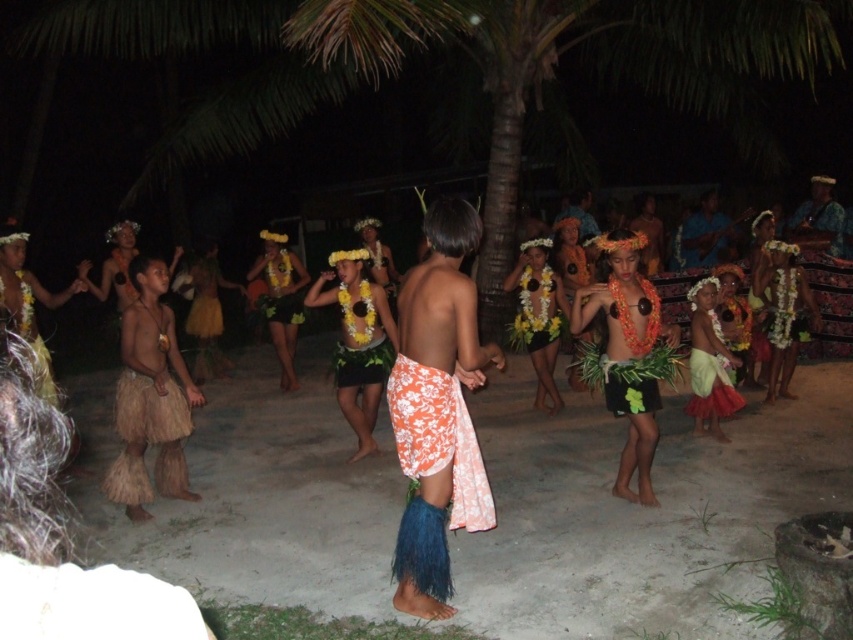
In the scene described, where is the floral fabric skirt at center located in terms of coordinates?

The floral fabric skirt at center is located at coordinates point [437,410].

From the picture: You are a photographer trying to capture the performers in the center of the scene. You notice the floral fabric skirt at center and the blue fabric guitar at center. Which object is closer to the camera?

The floral fabric skirt at center is positioned under the blue fabric guitar at center, so the blue fabric guitar at center is closer to the camera.